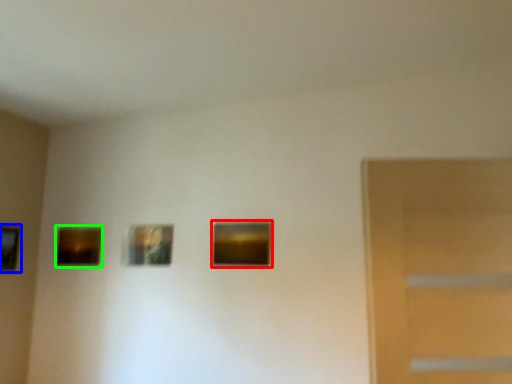
Question: Which object is the farthest from picture frame (highlighted by a red box)? Choose among these: picture frame (highlighted by a blue box) or picture frame (highlighted by a green box).

Choices:
 (A) picture frame
 (B) picture frame

Answer: (A)